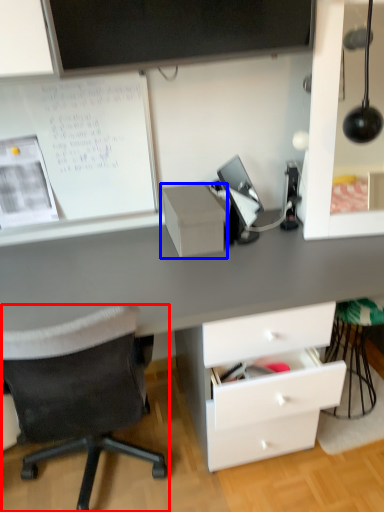
Question: Which object appears farthest to the camera in this image, chair (highlighted by a red box) or shelf (highlighted by a blue box)?

Choices:
 (A) chair
 (B) shelf

Answer: (B)